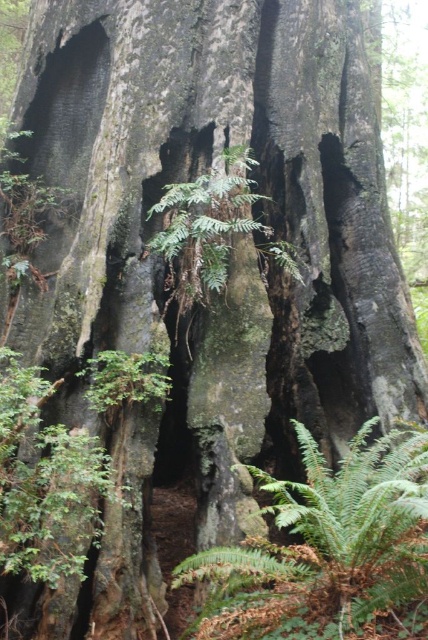
You are standing at the base of the ancient tree and want to move from the point at coordinates point (318,561) to the point at coordinates point (195,186). Which direction should you move in relation to the tree?

To move from point (318,561) to point (195,186), you should move towards the tree since point (318,561) is in front of point (195,186).